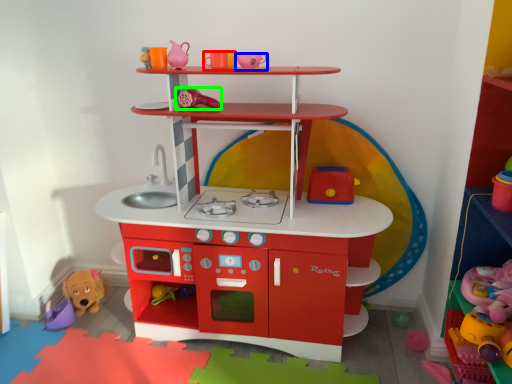
Question: Which object is the farthest from toy (highlighted by a red box)? Choose among these: toy (highlighted by a blue box) or toy (highlighted by a green box).

Choices:
 (A) toy
 (B) toy

Answer: (B)